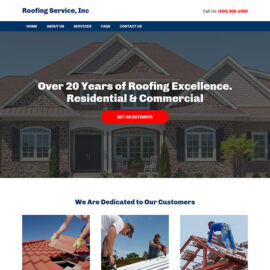
The width and height of the screenshot is (270, 270). I want to click on window transoms, so click(x=34, y=130), click(x=200, y=130), click(x=133, y=132).